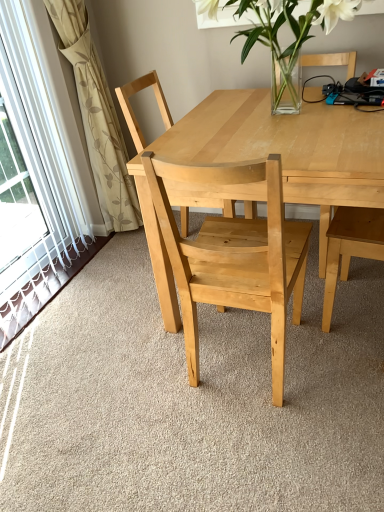
This screenshot has width=384, height=512. What do you see at coordinates (97, 117) in the screenshot?
I see `beige floral fabric at left` at bounding box center [97, 117].

What is the approximate width of natural wood table at center?

The width of natural wood table at center is 38.03 inches.

Identify the location of natural wood chair at center, placed as the first chair when sorted from back to front. (132, 109).

Image resolution: width=384 pixels, height=512 pixels. Describe the element at coordinates (132, 109) in the screenshot. I see `natural wood chair at center, placed as the first chair when sorted from back to front` at that location.

This screenshot has width=384, height=512. I want to click on clear glass vase at upper center, so click(x=290, y=28).

Locate an element on the screen. The image size is (384, 512). beige floral fabric at left is located at coordinates (97, 117).

Could you tell me if clear glass vase at upper center is turned towards natural wood table at center?

No, clear glass vase at upper center is not aimed at natural wood table at center.

Which of these two, clear glass vase at upper center or natural wood table at center, is bigger?

Bigger between the two is natural wood table at center.

From a real-world perspective, which object stands above the other?

clear glass vase at upper center.

Is point (317, 16) closer or farther from the camera than point (273, 289)?

Point (317, 16).

Find the location of a particular element. This screenshot has width=384, height=512. houseplant on the right of the natural wood chair at center, marked as the second chair in a back-to-front arrangement is located at coordinates (290, 28).

Is the position of clear glass vase at upper center less distant than that of natural wood chair at center, the 1th chair viewed from the front?

No, it is not.

Can you tell me how much clear glass vase at upper center and natural wood chair at center, marked as the second chair in a back-to-front arrangement, differ in facing direction?

There is a 177-degree angle between the facing directions of clear glass vase at upper center and natural wood chair at center, marked as the second chair in a back-to-front arrangement.

Is beige floral fabric at left placed right next to natural wood chair at center, which is counted as the second chair, starting from the front?

beige floral fabric at left is not next to natural wood chair at center, which is counted as the second chair, starting from the front, and they're not touching.

How different are the orientations of beige floral fabric at left and natural wood chair at center, which is counted as the second chair, starting from the front, in degrees?

The angular difference between beige floral fabric at left and natural wood chair at center, which is counted as the second chair, starting from the front, is 2 degrees.

Is beige floral fabric at left completely or partially outside of natural wood chair at center, which is counted as the second chair, starting from the front?

Absolutely, beige floral fabric at left is external to natural wood chair at center, which is counted as the second chair, starting from the front.

Which is more distant, (x=81, y=9) or (x=186, y=217)?

The point (x=186, y=217) is behind.

From a real-world perspective, which object rests below the other?

In real-world perspective, natural wood table at center is lower.

Which of these two, natural wood table at center or natural wood chair at center, marked as the second chair in a back-to-front arrangement, stands shorter?

Standing shorter between the two is natural wood table at center.

Between natural wood table at center and natural wood chair at center, marked as the second chair in a back-to-front arrangement, which one has smaller width?

natural wood chair at center, marked as the second chair in a back-to-front arrangement.

Which is in front, point (88, 70) or point (220, 234)?

The point (220, 234) is in front.

Is beige floral fabric at left wider than natural wood chair at center, marked as the second chair in a back-to-front arrangement?

Incorrect, the width of beige floral fabric at left does not surpass that of natural wood chair at center, marked as the second chair in a back-to-front arrangement.

What's the angular difference between beige floral fabric at left and natural wood chair at center, marked as the second chair in a back-to-front arrangement,'s facing directions?

They differ by 86.8 degrees in their facing directions.

Is beige floral fabric at left next to natural wood chair at center, the 1th chair viewed from the front?

beige floral fabric at left and natural wood chair at center, the 1th chair viewed from the front, are not in contact.

Consider the image. Is natural wood table at center not near clear glass vase at upper center?

natural wood table at center is near clear glass vase at upper center, not far away.

From the image's perspective, which one is positioned lower, natural wood table at center or clear glass vase at upper center?

From the image's view, natural wood table at center is below.

Considering the relative sizes of natural wood table at center and clear glass vase at upper center in the image provided, is natural wood table at center wider than clear glass vase at upper center?

Correct, the width of natural wood table at center exceeds that of clear glass vase at upper center.

In the scene shown: From a real-world perspective, is natural wood table at center beneath clear glass vase at upper center?

Indeed, from a real-world perspective, natural wood table at center is positioned beneath clear glass vase at upper center.

Measure the distance from clear glass vase at upper center to beige floral fabric at left.

clear glass vase at upper center is 32.85 inches away from beige floral fabric at left.

From a real-world perspective, is clear glass vase at upper center below beige floral fabric at left?

Actually, clear glass vase at upper center is physically above beige floral fabric at left in the real world.

In the scene shown: Is clear glass vase at upper center situated inside beige floral fabric at left or outside?

Result: clear glass vase at upper center exists outside the volume of beige floral fabric at left.

From the picture: Which of these two, clear glass vase at upper center or beige floral fabric at left, is thinner?

beige floral fabric at left is thinner.

You are a GUI agent. You are given a task and a screenshot of the screen. Output one action in this format:
    pyautogui.click(x=<x>, y=<y>)
    Task: Click on the kitchen & dining room table on the right side of clear glass vase at upper center
    This screenshot has width=384, height=512.
    Given the screenshot: What is the action you would take?
    (287, 148)

Where is `the 2nd chair positioned below the clear glass vase at upper center (from a real-world perspective)`? The image size is (384, 512). the 2nd chair positioned below the clear glass vase at upper center (from a real-world perspective) is located at coordinates (235, 257).

From the image, which object appears to be nearer to clear glass vase at upper center, natural wood chair at center, marked as the second chair in a back-to-front arrangement, or natural wood chair at center, which is counted as the second chair, starting from the front?

Based on the image, natural wood chair at center, which is counted as the second chair, starting from the front, appears to be nearer to clear glass vase at upper center.

Based on their spatial positions, is natural wood table at center or natural wood chair at center, which is counted as the second chair, starting from the front, closer to natural wood chair at center, the 1th chair viewed from the front?

natural wood table at center lies closer to natural wood chair at center, the 1th chair viewed from the front, than the other object.

Considering their positions, is natural wood chair at center, which is counted as the second chair, starting from the front, positioned further to clear glass vase at upper center than natural wood chair at center, marked as the second chair in a back-to-front arrangement?

The object further to clear glass vase at upper center is natural wood chair at center, marked as the second chair in a back-to-front arrangement.

Based on the photo, which object lies nearer to the anchor point natural wood chair at center, marked as the second chair in a back-to-front arrangement, natural wood table at center or beige floral fabric at left?

natural wood table at center.

Based on their spatial positions, is natural wood chair at center, which is counted as the second chair, starting from the front, or natural wood chair at center, the 1th chair viewed from the front, closer to beige floral fabric at left?

Based on the image, natural wood chair at center, which is counted as the second chair, starting from the front, appears to be nearer to beige floral fabric at left.

Which object lies nearer to the anchor point natural wood chair at center, marked as the second chair in a back-to-front arrangement, beige floral fabric at left or natural wood table at center?

natural wood table at center lies closer to natural wood chair at center, marked as the second chair in a back-to-front arrangement, than the other object.

Estimate the real-world distances between objects in this image. Which object is further from beige floral fabric at left, natural wood table at center or natural wood chair at center, which is counted as the second chair, starting from the front?

natural wood table at center is further to beige floral fabric at left.

From the picture: Looking at the image, which one is located closer to natural wood chair at center, placed as the first chair when sorted from back to front, natural wood chair at center, the 1th chair viewed from the front, or natural wood table at center?

natural wood table at center is closer to natural wood chair at center, placed as the first chair when sorted from back to front.

Identify the location of chair between clear glass vase at upper center and natural wood chair at center, marked as the second chair in a back-to-front arrangement, in the up-down direction. This screenshot has height=512, width=384. (132, 109).

I want to click on chair between clear glass vase at upper center and natural wood table at center from top to bottom, so click(x=132, y=109).

Identify the location of houseplant situated between beige floral fabric at left and natural wood table at center from left to right. (290, 28).

This screenshot has height=512, width=384. Find the location of `kitchen & dining room table between clear glass vase at upper center and natural wood chair at center, marked as the second chair in a back-to-front arrangement, in the up-down direction`. kitchen & dining room table between clear glass vase at upper center and natural wood chair at center, marked as the second chair in a back-to-front arrangement, in the up-down direction is located at coordinates (287, 148).